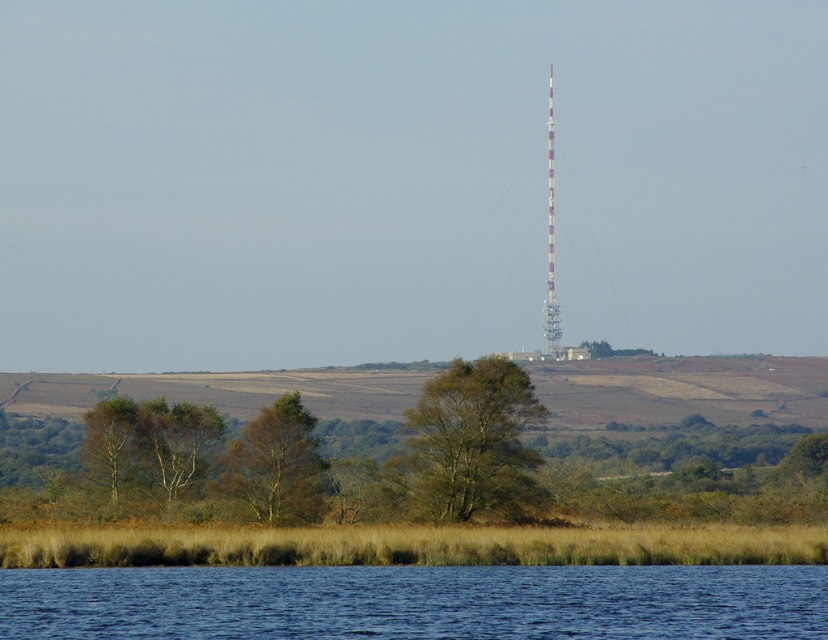
You are standing at the lakeside and see the green leafy tree at lower left and the white striped tower at center. Which object is taller?

The white striped tower at center is taller than the green leafy tree at lower left.

You are standing at the edge of the water and want to take a photo of both the green leafy tree at lower left and the white striped tower at center. Which object should you zoom in on to ensure both fit in the frame?

The green leafy tree at lower left might be wider than white striped tower at center, so you should zoom out to ensure both fit in the frame.

You are standing at the point labeled as point (x=470, y=442) in the image. Based on the scene description, what type of tree are you currently touching?

The point (x=470, y=442) is on a green rough bark tree at center, so you are touching a green rough bark tree at center.